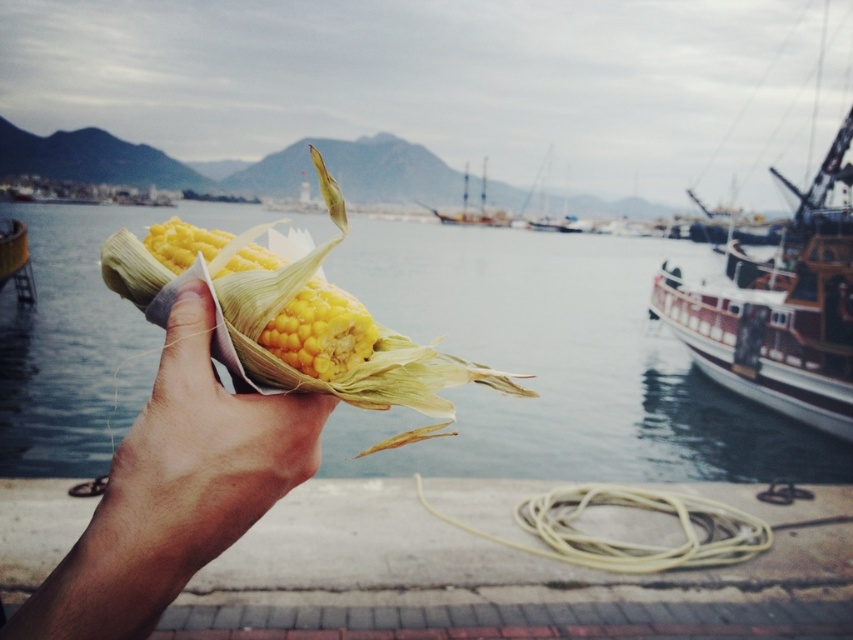
You are a photographer trying to capture the smooth skin hand at center and the boats docked along the pier in the same frame. The camera you are using has a minimum focus distance of 12 inches. Can you get both subjects in focus without moving the camera or the hand?

The smooth skin hand at center and the boats docked along the pier are 13.30 inches apart. Since the camera can focus as close as 12 inches, you can capture both subjects in focus as the distance between them is within the camera focus range.

You are standing at the waterfront and want to take a photo of the wooden ship at right without the yellow matte corn at center blocking the view. Is this possible based on their positions?

The wooden ship at right is positioned under the yellow matte corn at center, so taking a photo of the wooden ship at right without the yellow matte corn at center blocking the view would not be possible due to their spatial arrangement.